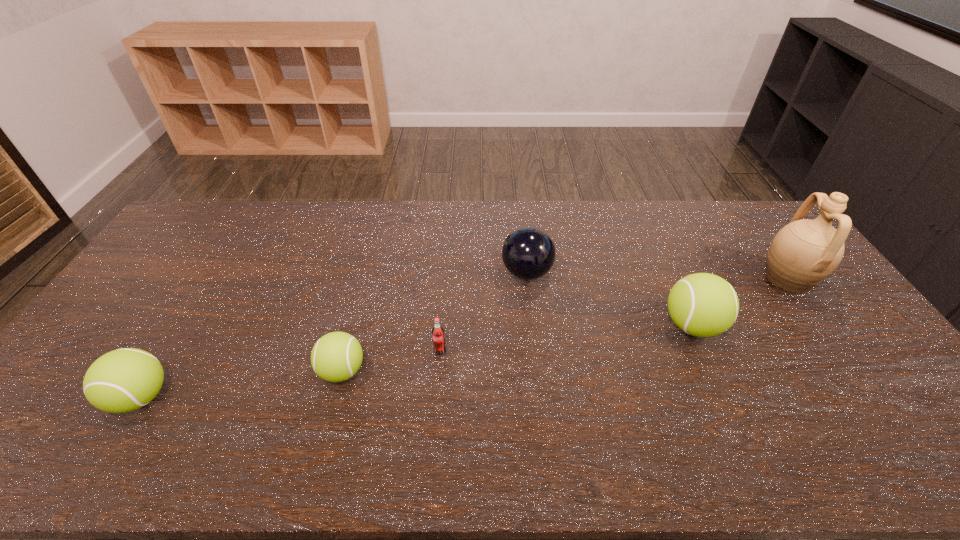
Please point a space for a new tennis_ball to maintain equal intervals. Please provide its 2D coordinates. Your answer should be formatted as a tuple, i.e. [(x, y)], where the tuple contains the x and y coordinates of a point satisfying the conditions above.

[(525, 347)]